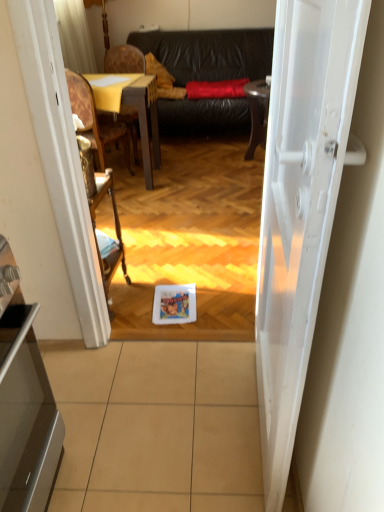
You are a GUI agent. You are given a task and a screenshot of the screen. Output one action in this format:
    pyautogui.click(x=<x>, y=<y>)
    Task: Click on the empty space that is ontop of beige tile at center (from a real-world perspective)
    The height and width of the screenshot is (512, 384).
    Given the screenshot: What is the action you would take?
    pyautogui.click(x=151, y=412)